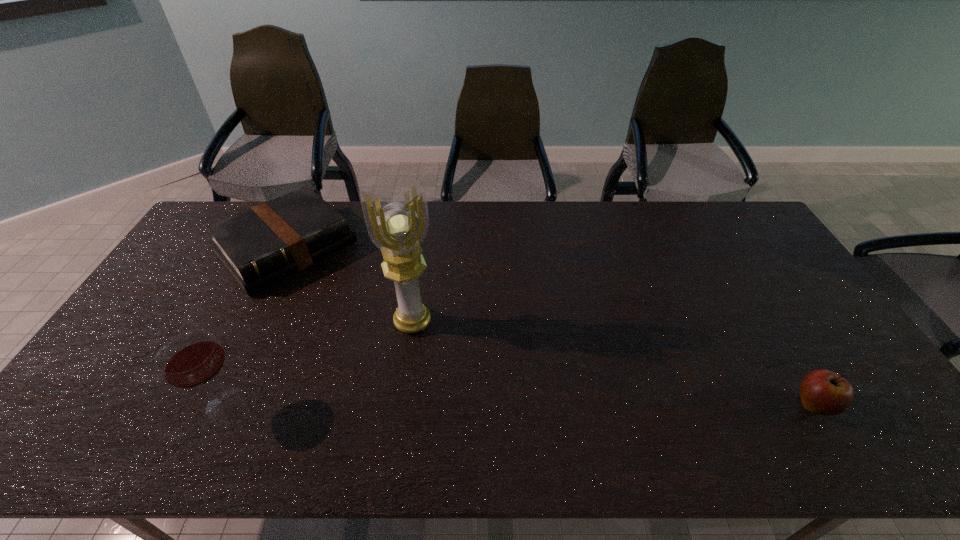
This screenshot has height=540, width=960. Identify the location of vacant point located on the front-facing side of the tallest object. (436, 383).

Where is `vacant region located on the front-facing side of the tallest object`? The image size is (960, 540). vacant region located on the front-facing side of the tallest object is located at coordinates pos(430,368).

Image resolution: width=960 pixels, height=540 pixels. Identify the location of vacant point located 0.400m on the spine side of the shortest object. (397, 360).

Identify the location of vacant space located 0.190m on the spine side of the shortest object. (354, 316).

You are a GUI agent. You are given a task and a screenshot of the screen. Output one action in this format:
    pyautogui.click(x=<x>, y=<y>)
    Task: Click on the free region located on the spine side of the shortest object
    
    Given the screenshot: What is the action you would take?
    pyautogui.click(x=393, y=355)

Image resolution: width=960 pixels, height=540 pixels. Find the location of `object at the far edge`. object at the far edge is located at coordinates (260, 246).

What are the coordinates of `wineglass located at the near edge` in the screenshot? It's located at (191, 359).

The height and width of the screenshot is (540, 960). Identify the location of apple positioned at the near edge. pyautogui.click(x=823, y=392).

The width and height of the screenshot is (960, 540). In order to click on object that is at the left edge in this screenshot , I will do `click(260, 246)`.

The height and width of the screenshot is (540, 960). In order to click on object that is at the right edge in this screenshot , I will do `click(823, 392)`.